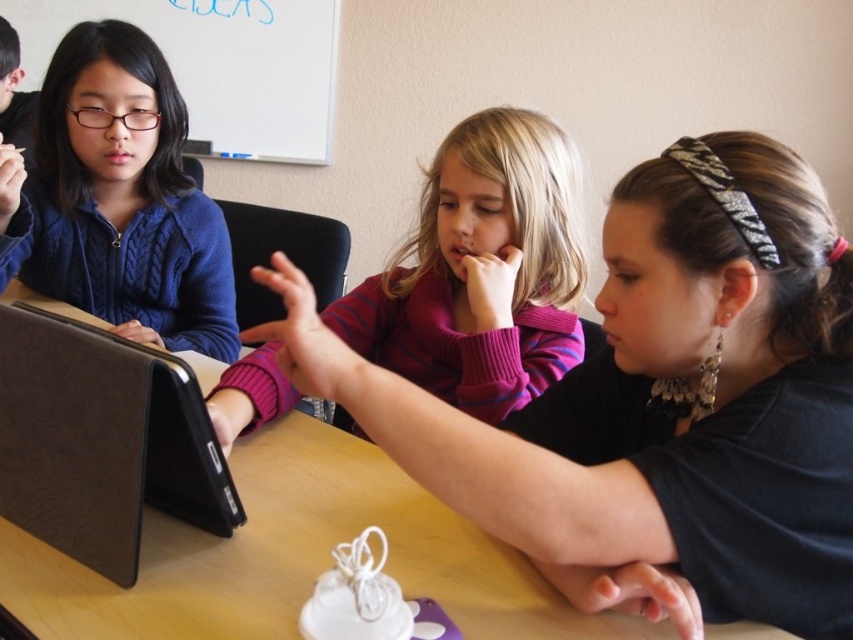
Question: Does black matte shirt at center have a greater width compared to cable-knit sweater at upper left?

Choices:
 (A) no
 (B) yes

Answer: (B)

Question: In this image, where is purple striped sweater at center located relative to cable-knit sweater at upper left?

Choices:
 (A) above
 (B) below

Answer: (B)

Question: Among these points, which one is nearest to the camera?

Choices:
 (A) coord(154,61)
 (B) coord(805,179)
 (C) coord(294,3)
 (D) coord(436,182)

Answer: (B)

Question: Considering the real-world distances, which object is closest to the black matte shirt at center?

Choices:
 (A) purple striped sweater at center
 (B) cable-knit sweater at upper left

Answer: (A)

Question: Which is farther from the cable-knit sweater at upper left?

Choices:
 (A) purple striped sweater at center
 (B) whiteboard at upper center
 (C) black leather laptop at left

Answer: (B)

Question: Can you confirm if black matte shirt at center is positioned above cable-knit sweater at upper left?

Choices:
 (A) yes
 (B) no

Answer: (B)